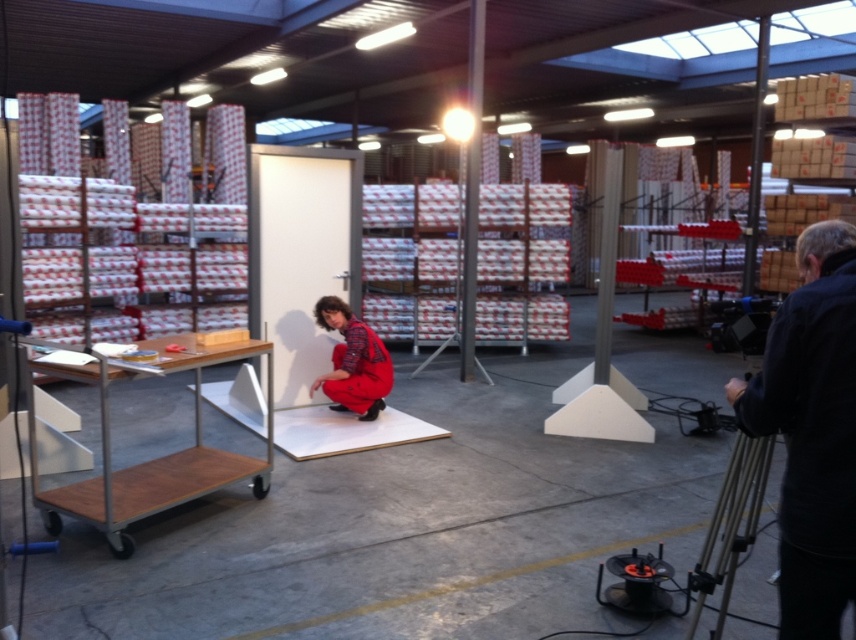
I want to click on brown wooden trolley at left, so click(153, 458).

Does point (206, 349) lie behind point (343, 381)?

No, (206, 349) is closer to viewer.

This screenshot has height=640, width=856. I want to click on brown wooden trolley at left, so click(153, 458).

Can you confirm if black fabric at right is positioned above brown wooden trolley at left?

Correct, black fabric at right is located above brown wooden trolley at left.

Between point (836, 260) and point (100, 419), which one is positioned in front?

Positioned in front is point (836, 260).

Image resolution: width=856 pixels, height=640 pixels. I want to click on black fabric at right, so click(811, 429).

Image resolution: width=856 pixels, height=640 pixels. What are the coordinates of `black fabric at right` in the screenshot? It's located at (811, 429).

Which is in front, point (800, 593) or point (330, 296)?

Point (800, 593) is more forward.

Is black fabric at right closer to camera compared to red plaid jumpsuit at center?

Result: Yes, black fabric at right is in front of red plaid jumpsuit at center.

The height and width of the screenshot is (640, 856). I want to click on black fabric at right, so click(811, 429).

The height and width of the screenshot is (640, 856). In order to click on black fabric at right in this screenshot , I will do `click(811, 429)`.